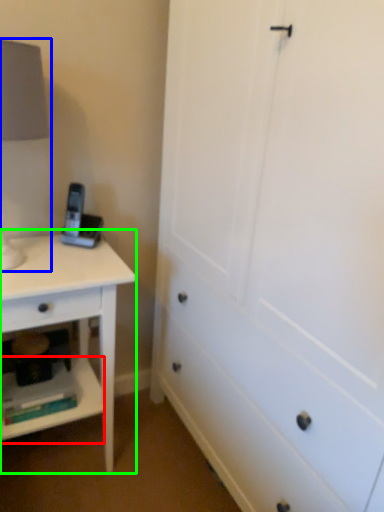
Question: Based on their relative distances, which object is nearer to shelf (highlighted by a red box)? Choose from table lamp (highlighted by a blue box) and nightstand (highlighted by a green box).

Choices:
 (A) table lamp
 (B) nightstand

Answer: (B)